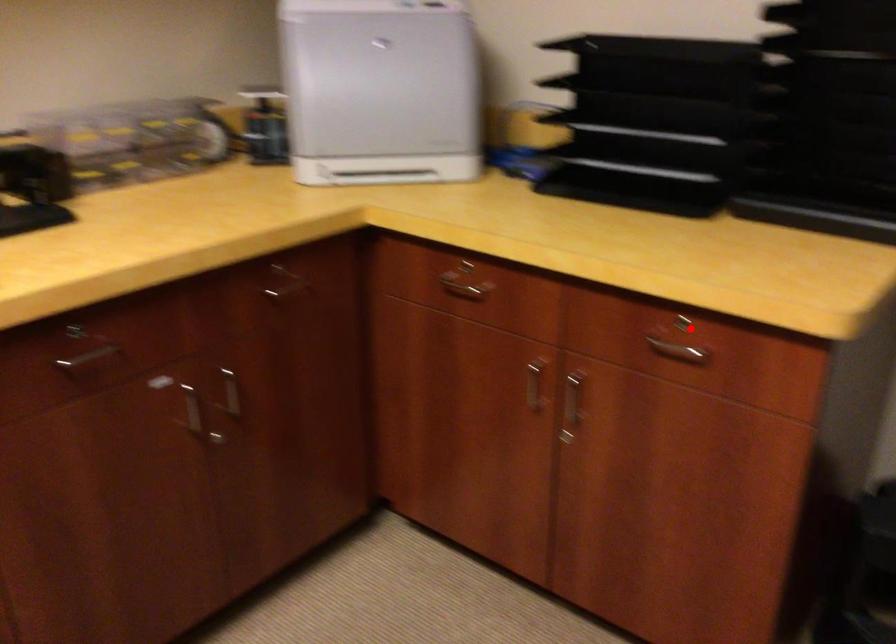
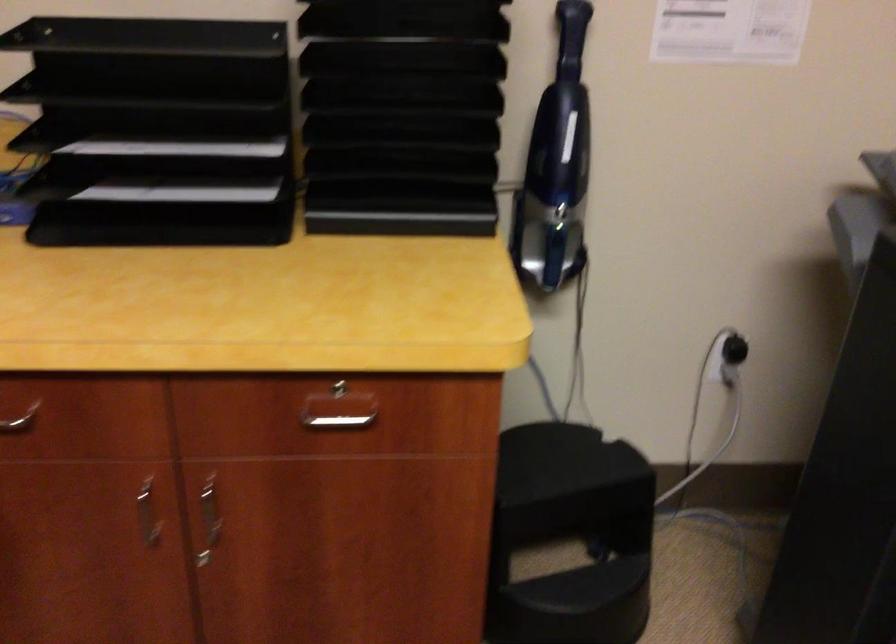
Question: I am providing you with two images of the same scene from different viewpoints. In image1, a red point is highlighted. Considering the same 3D point in image2, which of the following is correct?

Choices:
 (A) It is closer
 (B) It is farther

Answer: (A)